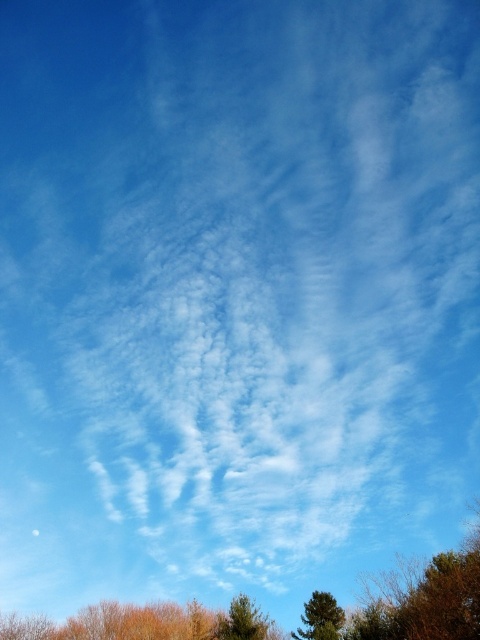
Question: Is brown textured tree at lower center closer to the viewer compared to green matte tree at lower center?

Choices:
 (A) yes
 (B) no

Answer: (A)

Question: Is green matte tree at lower center to the right of green textured tree at lower center from the viewer's perspective?

Choices:
 (A) yes
 (B) no

Answer: (B)

Question: Among these points, which one is nearest to the camera?

Choices:
 (A) (223, 634)
 (B) (396, 602)

Answer: (B)

Question: From the image, what is the correct spatial relationship of green matte tree at lower center in relation to green textured tree at lower center?

Choices:
 (A) left
 (B) right

Answer: (A)

Question: Which of the following is the closest to the observer?

Choices:
 (A) green matte tree at lower center
 (B) brown leafy tree at lower right

Answer: (B)

Question: Which object appears closest to the camera in this image?

Choices:
 (A) green matte tree at lower center
 (B) brown leafy tree at lower right
 (C) green textured tree at lower center
 (D) brown textured tree at lower center

Answer: (B)